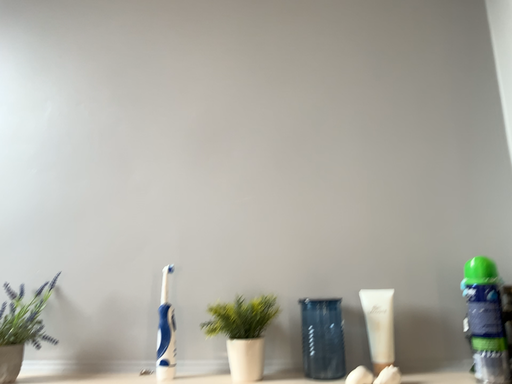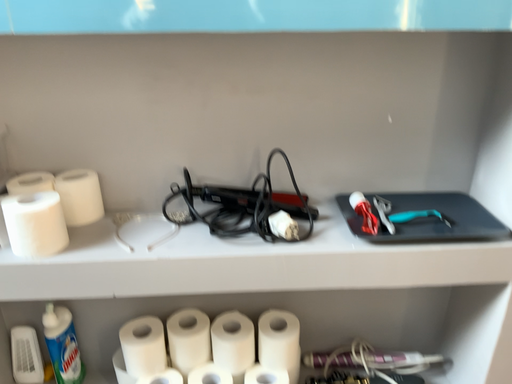
Question: Which way did the camera rotate in the video?

Choices:
 (A) rotated right
 (B) rotated left

Answer: (A)